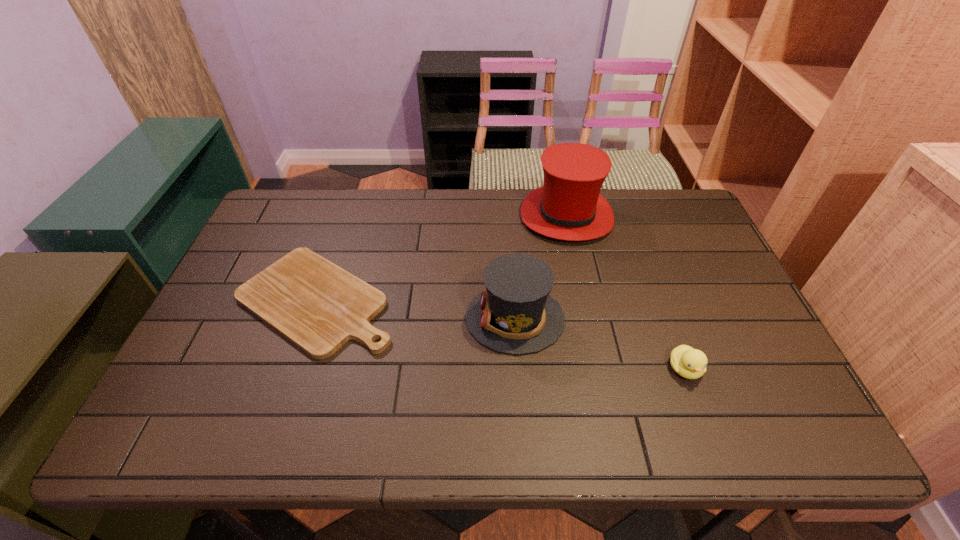
What are the coordinates of `free space at the near right corner of the desktop` in the screenshot? It's located at (781, 416).

Locate an element on the screen. Image resolution: width=960 pixels, height=540 pixels. free space that is in between the duckling and the farther dress hat is located at coordinates (626, 293).

What are the coordinates of `free space between the third tallest object and the farthest object` in the screenshot? It's located at (626, 293).

Find the location of `free point between the tallest object and the chopping board`. free point between the tallest object and the chopping board is located at coordinates (442, 258).

The image size is (960, 540). Find the location of `free space that is in between the third tallest object and the farther dress hat`. free space that is in between the third tallest object and the farther dress hat is located at coordinates click(626, 293).

Locate an element on the screen. The height and width of the screenshot is (540, 960). free space that is in between the tallest object and the duckling is located at coordinates (626, 293).

Locate an element on the screen. Image resolution: width=960 pixels, height=540 pixels. empty space that is in between the chopping board and the farthest object is located at coordinates (442, 258).

I want to click on empty space between the rightmost object and the tallest object, so coord(626,293).

Where is `object that is the closest to the second tallest object`? Image resolution: width=960 pixels, height=540 pixels. object that is the closest to the second tallest object is located at coordinates (569, 206).

Find the location of `the third closest object relative to the third shortest object`. the third closest object relative to the third shortest object is located at coordinates (690, 363).